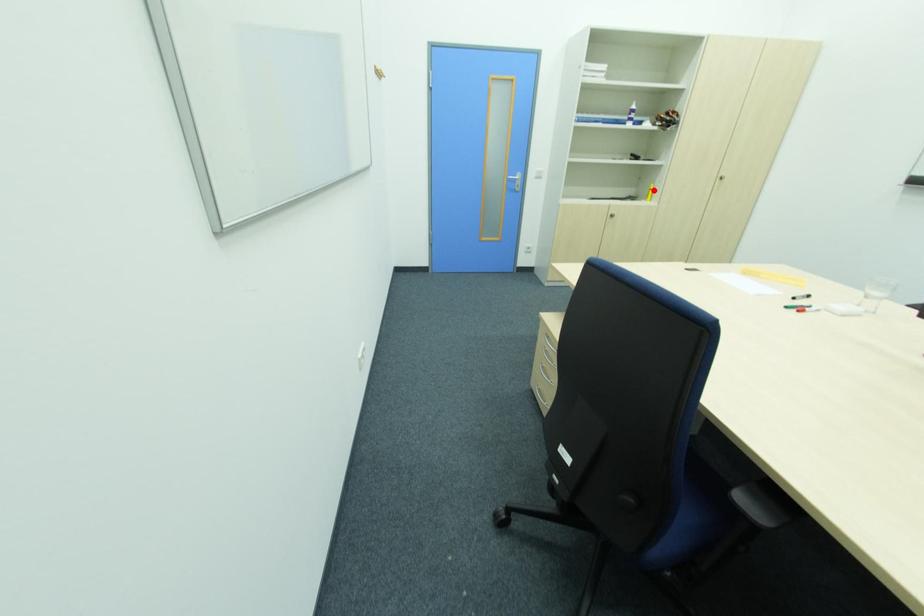
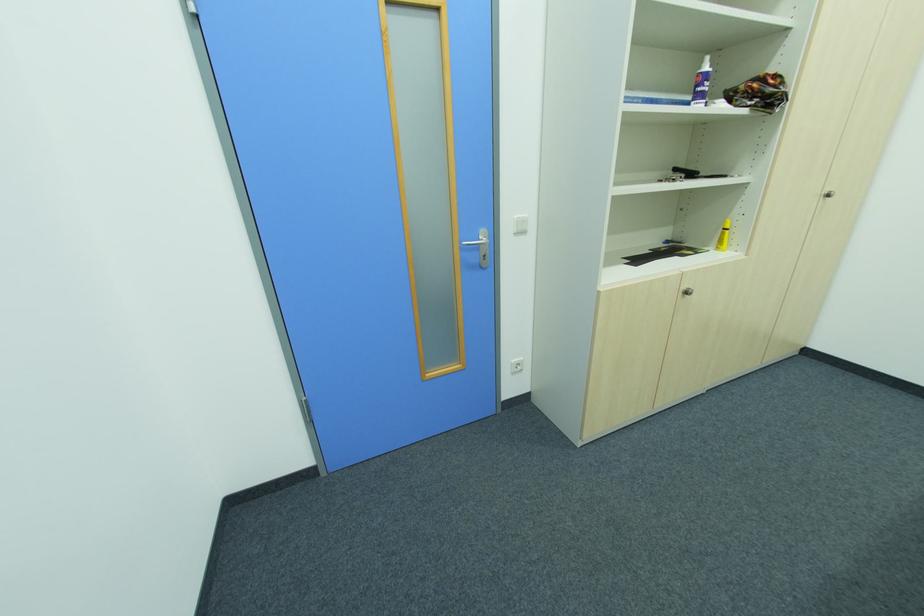
Question: I am providing you with two images of the same scene from different viewpoints. A red point is marked on the first image. Is the red point's position out of view in image 2?

Choices:
 (A) Yes
 (B) No

Answer: (B)